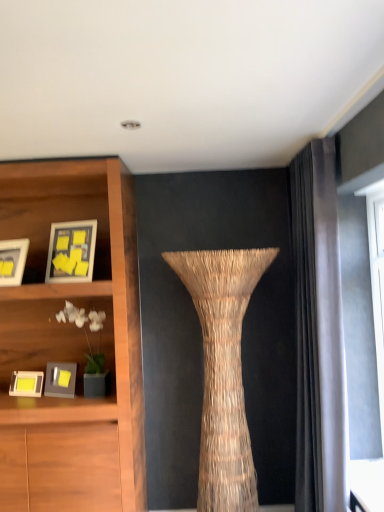
Question: Is matte gray shelf at left further to camera compared to matte white picture frame at left, placed as the second picture frame when sorted from top to bottom?

Choices:
 (A) no
 (B) yes

Answer: (B)

Question: Is matte gray shelf at left wider than matte white picture frame at left, placed as the second picture frame when sorted from top to bottom?

Choices:
 (A) no
 (B) yes

Answer: (B)

Question: Considering the relative sizes of matte gray shelf at left and matte white picture frame at left, which ranks as the third picture frame in bottom-to-top order, in the image provided, is matte gray shelf at left bigger than matte white picture frame at left, which ranks as the third picture frame in bottom-to-top order,?

Choices:
 (A) yes
 (B) no

Answer: (A)

Question: Is matte gray shelf at left positioned beyond the bounds of matte white picture frame at left, placed as the second picture frame when sorted from top to bottom?

Choices:
 (A) no
 (B) yes

Answer: (B)

Question: Are matte gray shelf at left and matte white picture frame at left, which ranks as the third picture frame in bottom-to-top order, far apart?

Choices:
 (A) no
 (B) yes

Answer: (A)

Question: Are matte gray shelf at left and matte white picture frame at left, placed as the second picture frame when sorted from top to bottom, making contact?

Choices:
 (A) no
 (B) yes

Answer: (A)

Question: From a real-world perspective, is matte gray shelf at left positioned over matte wooden picture frame at upper left, marked as the 4th picture frame in a bottom-to-top arrangement, based on gravity?

Choices:
 (A) yes
 (B) no

Answer: (B)

Question: Is matte gray shelf at left positioned with its back to matte wooden picture frame at upper left, positioned as the first picture frame in top-to-bottom order?

Choices:
 (A) yes
 (B) no

Answer: (B)

Question: From the image's perspective, is matte gray shelf at left under matte wooden picture frame at upper left, positioned as the first picture frame in top-to-bottom order?

Choices:
 (A) yes
 (B) no

Answer: (A)

Question: Can you confirm if matte gray shelf at left is bigger than matte wooden picture frame at upper left, positioned as the first picture frame in top-to-bottom order?

Choices:
 (A) no
 (B) yes

Answer: (B)

Question: Is matte wooden picture frame at upper left, marked as the 4th picture frame in a bottom-to-top arrangement, inside matte gray shelf at left?

Choices:
 (A) no
 (B) yes

Answer: (A)

Question: Can you confirm if matte gray shelf at left is thinner than matte wooden picture frame at upper left, marked as the 4th picture frame in a bottom-to-top arrangement?

Choices:
 (A) yes
 (B) no

Answer: (B)

Question: Are matte wooden picture frame at upper left, positioned as the first picture frame in top-to-bottom order, and matte yellow picture frame at left, positioned as the fourth picture frame in top-to-bottom order, located far from each other?

Choices:
 (A) yes
 (B) no

Answer: (B)